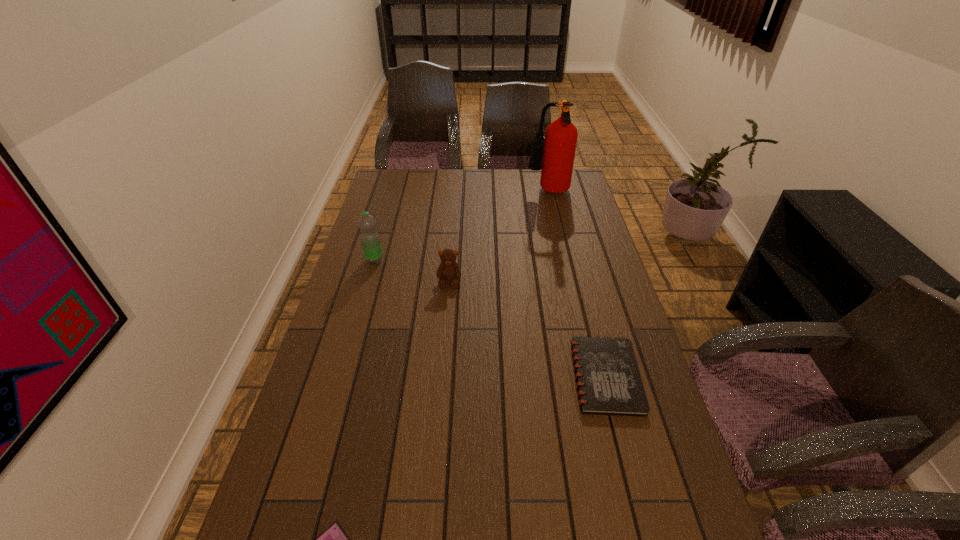
In the image, there is a desktop. Identify the location of vacant region at the left edge. click(x=394, y=197).

The image size is (960, 540). Identify the location of vacant region at the right edge of the desktop. (602, 320).

Where is `free space at the far right corner of the desktop`? free space at the far right corner of the desktop is located at coordinates click(548, 195).

Locate an element on the screen. free space between the tallest object and the third tallest object is located at coordinates pyautogui.click(x=499, y=237).

The height and width of the screenshot is (540, 960). Identify the location of free area in between the farthest object and the water bottle. (462, 227).

This screenshot has width=960, height=540. I want to click on empty space that is in between the farthest object and the third object from right to left, so click(499, 237).

Where is `free space between the water bottle and the third object from right to left`? free space between the water bottle and the third object from right to left is located at coordinates (x=412, y=271).

Where is `unoccupied area between the farthest object and the second shortest object`? unoccupied area between the farthest object and the second shortest object is located at coordinates (577, 285).

At what (x,y) coordinates should I click in order to perform the action: click on object that is the second closest to the notebook. Please return your answer as a coordinate pair (x, y). This screenshot has width=960, height=540. Looking at the image, I should click on (333, 539).

The image size is (960, 540). In order to click on object that is the second nearest to the third object from left to right in this screenshot , I will do `click(608, 379)`.